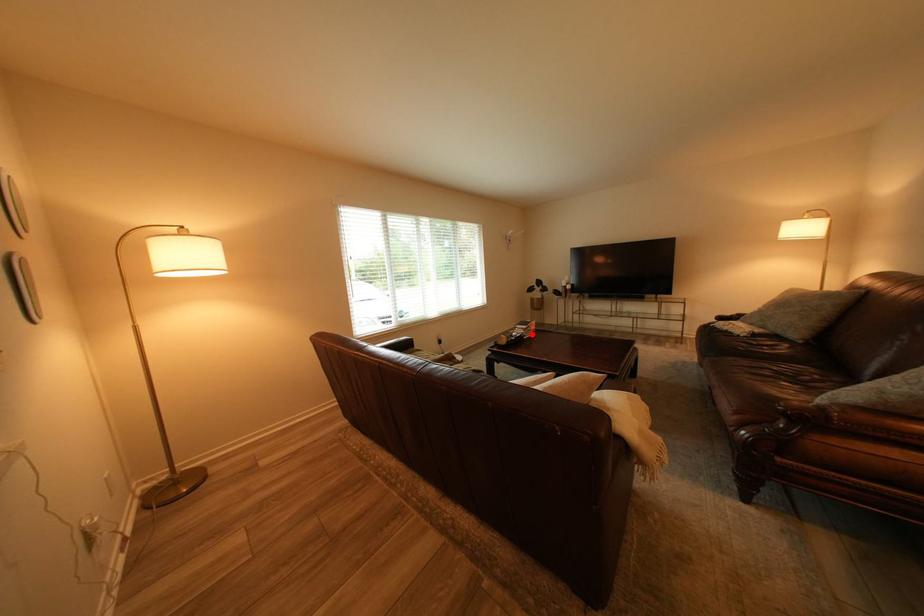
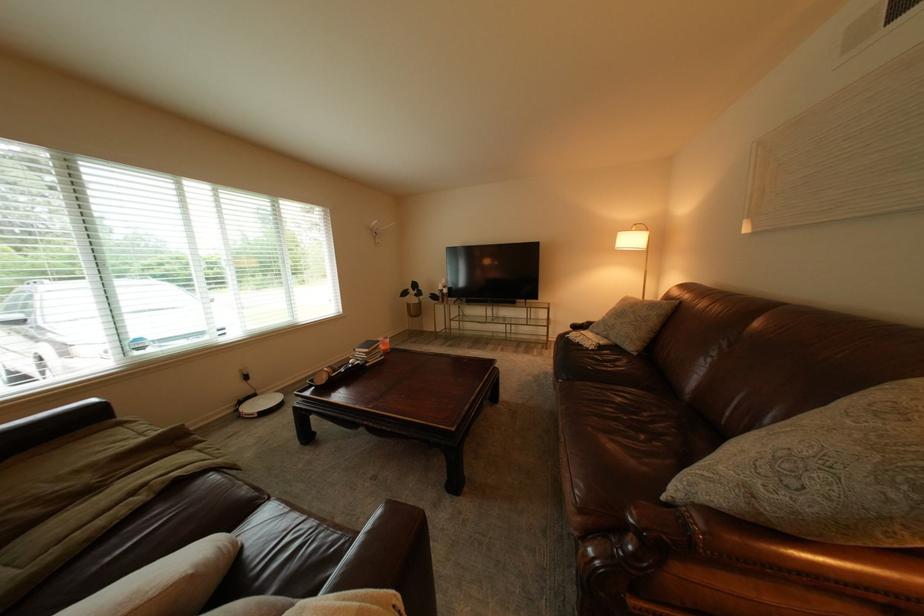
Question: I am providing you with two images of the same scene from different viewpoints. Image1 has a red point marked. In image2, the corresponding 3D location appears at what relative position? Reply with the corresponding letter.

Choices:
 (A) Closer
 (B) Farther

Answer: (A)